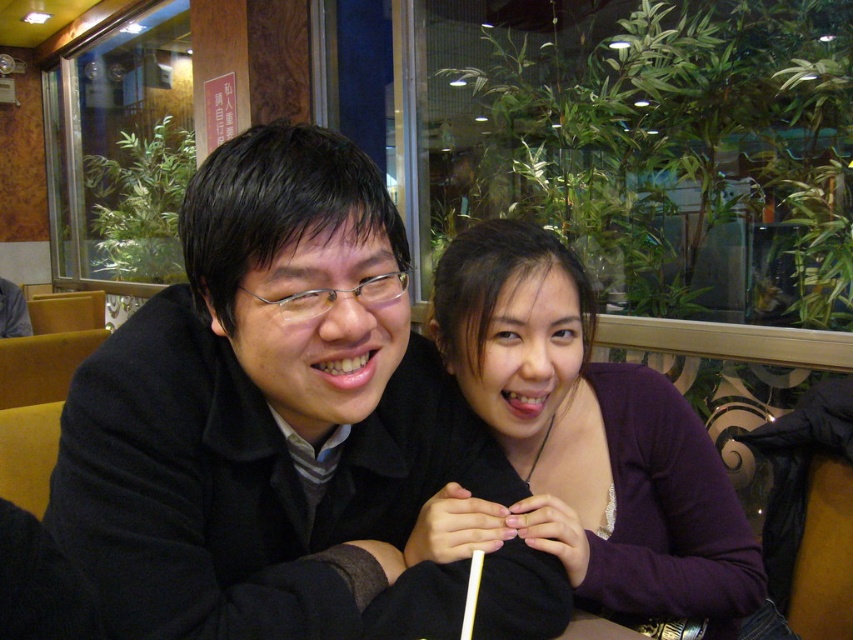
Does black matte jacket at center have a greater width compared to purple matte sweater at center?

Yes, black matte jacket at center is wider than purple matte sweater at center.

Is black matte jacket at center above purple matte sweater at center?

Correct, black matte jacket at center is located above purple matte sweater at center.

Identify the location of black matte jacket at center. Image resolution: width=853 pixels, height=640 pixels. (271, 419).